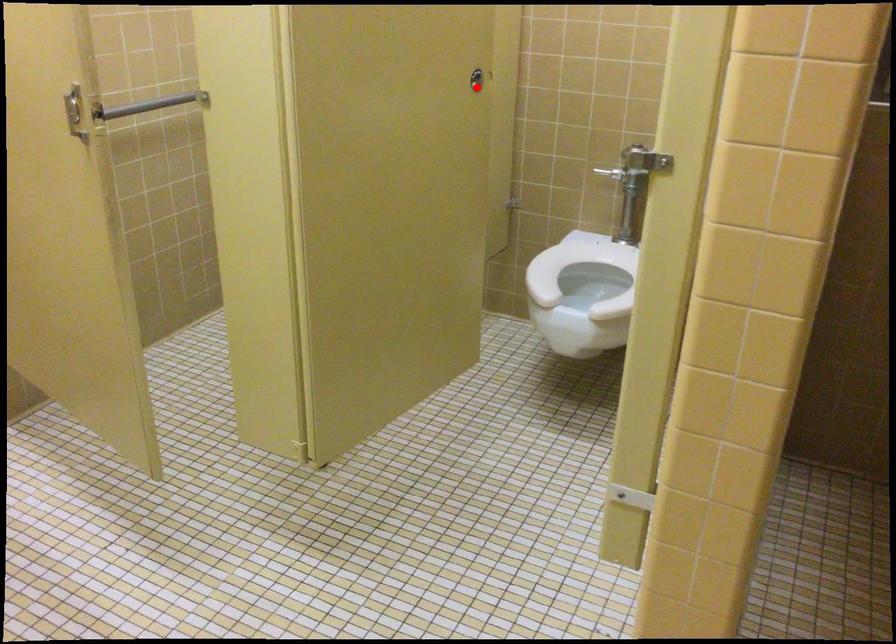
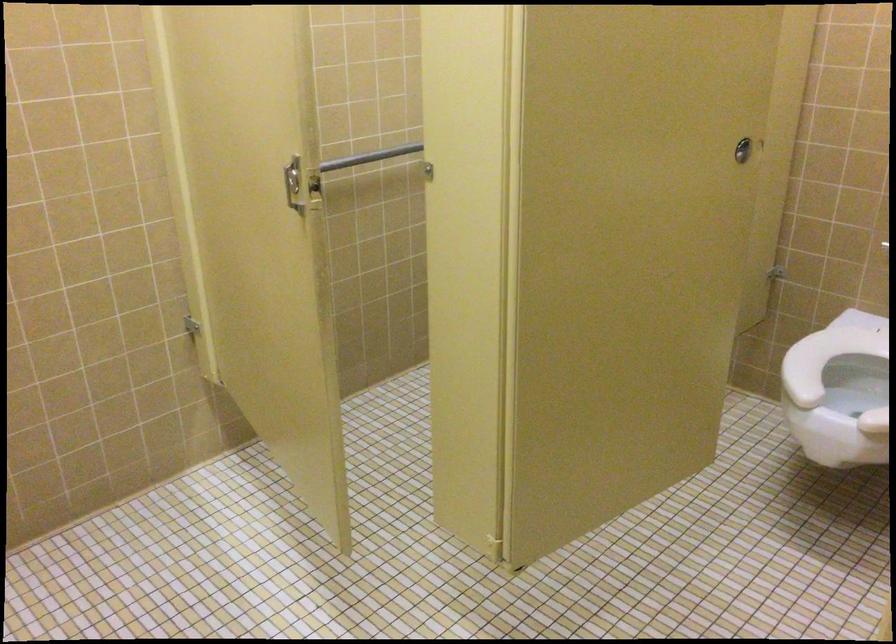
Question: I am providing you with two images of the same scene from different viewpoints. Image1 has a red point marked. In image2, the corresponding 3D location appears at what relative position? Reply with the corresponding letter.

Choices:
 (A) Closer
 (B) Farther

Answer: (A)